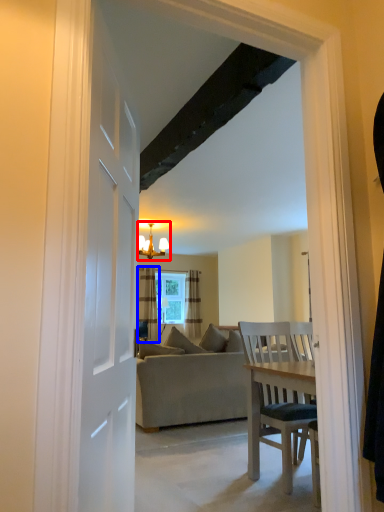
Question: Which object appears closest to the camera in this image, light fixture (highlighted by a red box) or curtain (highlighted by a blue box)?

Choices:
 (A) light fixture
 (B) curtain

Answer: (A)